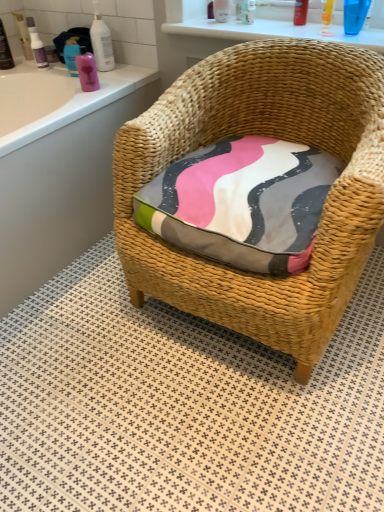
Question: Is matte plastic bottle at upper left, acting as the 9th toiletry starting from the right, taller or shorter than translucent plastic bottle at upper left, the 3th toiletry positioned from the left?

Choices:
 (A) short
 (B) tall

Answer: (B)

Question: In terms of size, does matte plastic bottle at upper left, the 2th toiletry in the left-to-right sequence, appear bigger or smaller than translucent plastic bottle at upper left, which is the eighth toiletry from right to left?

Choices:
 (A) big
 (B) small

Answer: (A)

Question: Which object is the closest to the translucent plastic bottle at upper center, acting as the 7th toiletry starting from the left?

Choices:
 (A) matte black bottle at upper left, which is the tenth toiletry from right to left
 (B) pink glossy bottle at upper left, the fourth toiletry viewed from the left
 (C) translucent plastic bottle at upper left, which is the eighth toiletry from right to left
 (D) white textured tile at center
 (E) translucent plastic bottle at upper center, which is the eighth toiletry in left-to-right order

Answer: (E)

Question: Which object is the closest to the pink glossy bottle at upper left, the fifth toiletry viewed from the left?

Choices:
 (A) white textured tile at center
 (B) pink glossy bottle at upper left, acting as the seventh toiletry starting from the right
 (C) matte black bottle at upper left, the 1th toiletry when ordered from left to right
 (D) matte plastic bottle at upper left, the 2th toiletry in the left-to-right sequence
 (E) translucent plastic bottle at upper center, placed as the fourth toiletry when sorted from right to left

Answer: (B)